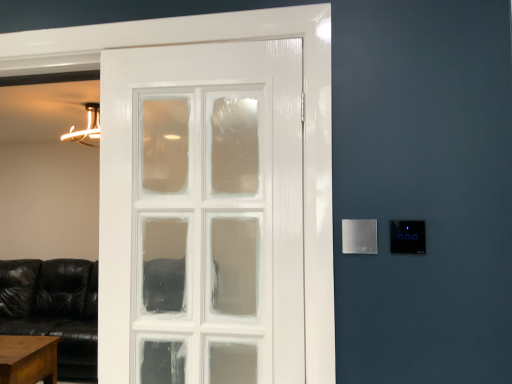
At what (x,y) coordinates should I click in order to perform the action: click on satin silver panel at right, which is the 1th light switch in right-to-left order. Please return your answer as a coordinate pair (x, y). The image size is (512, 384). Looking at the image, I should click on (407, 237).

Image resolution: width=512 pixels, height=384 pixels. I want to click on satin silver panel at right, the 1th light switch from the left, so coord(359,236).

In the scene shown: Which of these two, satin silver panel at right, marked as the 2th light switch in a right-to-left arrangement, or brown wooden table at lower left, is wider?

Wider between the two is brown wooden table at lower left.

From the image's perspective, which object appears higher, satin silver panel at right, marked as the 2th light switch in a right-to-left arrangement, or brown wooden table at lower left?

satin silver panel at right, marked as the 2th light switch in a right-to-left arrangement, from the image's perspective.

Which is less distant, (362, 224) or (52, 348)?

Point (362, 224) appears to be closer to the viewer than point (52, 348).

Does satin silver panel at right, arranged as the 2th light switch when viewed from the left, have a greater width compared to satin silver panel at right, the 1th light switch from the left?

No, satin silver panel at right, arranged as the 2th light switch when viewed from the left, is not wider than satin silver panel at right, the 1th light switch from the left.

Considering the sizes of satin silver panel at right, arranged as the 2th light switch when viewed from the left, and satin silver panel at right, marked as the 2th light switch in a right-to-left arrangement, in the image, is satin silver panel at right, arranged as the 2th light switch when viewed from the left, bigger or smaller than satin silver panel at right, marked as the 2th light switch in a right-to-left arrangement,?

Clearly, satin silver panel at right, arranged as the 2th light switch when viewed from the left, is smaller in size than satin silver panel at right, marked as the 2th light switch in a right-to-left arrangement.

Considering the positions of points (410, 221) and (357, 230), is point (410, 221) farther from camera compared to point (357, 230)?

No.

Where is `light switch above the satin silver panel at right, the 1th light switch from the left (from a real-world perspective)`? light switch above the satin silver panel at right, the 1th light switch from the left (from a real-world perspective) is located at coordinates (407, 237).

Which is more to the right, satin silver panel at right, arranged as the 2th light switch when viewed from the left, or brown wooden table at lower left?

satin silver panel at right, arranged as the 2th light switch when viewed from the left.

Is satin silver panel at right, arranged as the 2th light switch when viewed from the left, directly adjacent to brown wooden table at lower left?

No, satin silver panel at right, arranged as the 2th light switch when viewed from the left, is not beside brown wooden table at lower left.

Considering the sizes of satin silver panel at right, arranged as the 2th light switch when viewed from the left, and brown wooden table at lower left in the image, is satin silver panel at right, arranged as the 2th light switch when viewed from the left, taller or shorter than brown wooden table at lower left?

Clearly, satin silver panel at right, arranged as the 2th light switch when viewed from the left, is shorter compared to brown wooden table at lower left.

Locate an element on the screen. Image resolution: width=512 pixels, height=384 pixels. table behind the satin silver panel at right, arranged as the 2th light switch when viewed from the left is located at coordinates (28, 359).

Is the position of brown wooden table at lower left more distant than that of satin silver panel at right, marked as the 2th light switch in a right-to-left arrangement?

Yes, brown wooden table at lower left is further from the camera.

From the image's perspective, would you say brown wooden table at lower left is shown under satin silver panel at right, the 1th light switch from the left?

Yes, from the image's perspective, brown wooden table at lower left is beneath satin silver panel at right, the 1th light switch from the left.

What's the angular difference between brown wooden table at lower left and satin silver panel at right, the 1th light switch from the left,'s facing directions?

The facing directions of brown wooden table at lower left and satin silver panel at right, the 1th light switch from the left, are 0.342 degrees apart.

Does satin silver panel at right, marked as the 2th light switch in a right-to-left arrangement, have a larger size compared to satin silver panel at right, which is the 1th light switch in right-to-left order?

Correct, satin silver panel at right, marked as the 2th light switch in a right-to-left arrangement, is larger in size than satin silver panel at right, which is the 1th light switch in right-to-left order.

How distant is satin silver panel at right, the 1th light switch from the left, from satin silver panel at right, which is the 1th light switch in right-to-left order?

satin silver panel at right, the 1th light switch from the left, is 3.26 inches from satin silver panel at right, which is the 1th light switch in right-to-left order.

Which is more to the right, satin silver panel at right, marked as the 2th light switch in a right-to-left arrangement, or satin silver panel at right, which is the 1th light switch in right-to-left order?

From the viewer's perspective, satin silver panel at right, which is the 1th light switch in right-to-left order, appears more on the right side.

Is satin silver panel at right, marked as the 2th light switch in a right-to-left arrangement, with satin silver panel at right, which is the 1th light switch in right-to-left order?

Yes, satin silver panel at right, marked as the 2th light switch in a right-to-left arrangement, is right next to satin silver panel at right, which is the 1th light switch in right-to-left order, and making contact.

Considering the positions of objects brown wooden table at lower left and satin silver panel at right, which is the 1th light switch in right-to-left order, in the image provided, who is in front, brown wooden table at lower left or satin silver panel at right, which is the 1th light switch in right-to-left order,?

satin silver panel at right, which is the 1th light switch in right-to-left order, is in front.

Between brown wooden table at lower left and satin silver panel at right, which is the 1th light switch in right-to-left order, which one has larger size?

With larger size is brown wooden table at lower left.

Are brown wooden table at lower left and satin silver panel at right, which is the 1th light switch in right-to-left order, located far from each other?

brown wooden table at lower left is positioned a significant distance from satin silver panel at right, which is the 1th light switch in right-to-left order.

There is a brown wooden table at lower left. What are the coordinates of `the 1st light switch above it (from a real-world perspective)` in the screenshot? It's located at coord(359,236).

Locate an element on the screen. Image resolution: width=512 pixels, height=384 pixels. light switch located on the right of satin silver panel at right, marked as the 2th light switch in a right-to-left arrangement is located at coordinates (407, 237).

From the image, which object appears to be nearer to satin silver panel at right, the 1th light switch from the left, brown wooden table at lower left or satin silver panel at right, arranged as the 2th light switch when viewed from the left?

Among the two, satin silver panel at right, arranged as the 2th light switch when viewed from the left, is located nearer to satin silver panel at right, the 1th light switch from the left.

Which object lies nearer to the anchor point satin silver panel at right, marked as the 2th light switch in a right-to-left arrangement, satin silver panel at right, arranged as the 2th light switch when viewed from the left, or brown wooden table at lower left?

satin silver panel at right, arranged as the 2th light switch when viewed from the left, lies closer to satin silver panel at right, marked as the 2th light switch in a right-to-left arrangement, than the other object.

Based on their spatial positions, is satin silver panel at right, the 1th light switch from the left, or brown wooden table at lower left closer to satin silver panel at right, arranged as the 2th light switch when viewed from the left?

satin silver panel at right, the 1th light switch from the left, is positioned closer to the anchor satin silver panel at right, arranged as the 2th light switch when viewed from the left.

Based on their spatial positions, is satin silver panel at right, which is the 1th light switch in right-to-left order, or satin silver panel at right, the 1th light switch from the left, closer to brown wooden table at lower left?

Based on the image, satin silver panel at right, the 1th light switch from the left, appears to be nearer to brown wooden table at lower left.

In the scene shown: When comparing their distances from brown wooden table at lower left, does satin silver panel at right, marked as the 2th light switch in a right-to-left arrangement, or satin silver panel at right, arranged as the 2th light switch when viewed from the left, seem further?

satin silver panel at right, arranged as the 2th light switch when viewed from the left, is positioned further to the anchor brown wooden table at lower left.

Looking at the image, which one is located closer to satin silver panel at right, which is the 1th light switch in right-to-left order, brown wooden table at lower left or satin silver panel at right, the 1th light switch from the left?

satin silver panel at right, the 1th light switch from the left.

This screenshot has height=384, width=512. I want to click on light switch between brown wooden table at lower left and satin silver panel at right, arranged as the 2th light switch when viewed from the left, in the horizontal direction, so click(x=359, y=236).